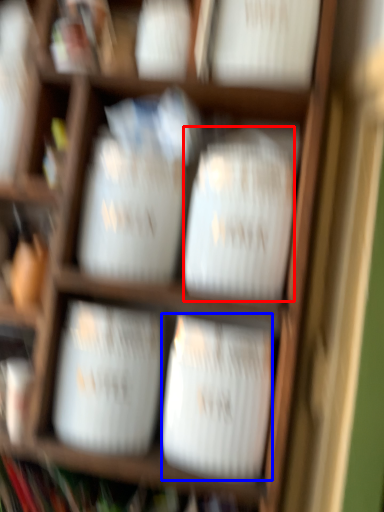
Question: Which point is further to the camera, wide (highlighted by a red box) or wide (highlighted by a blue box)?

Choices:
 (A) wide
 (B) wide

Answer: (B)